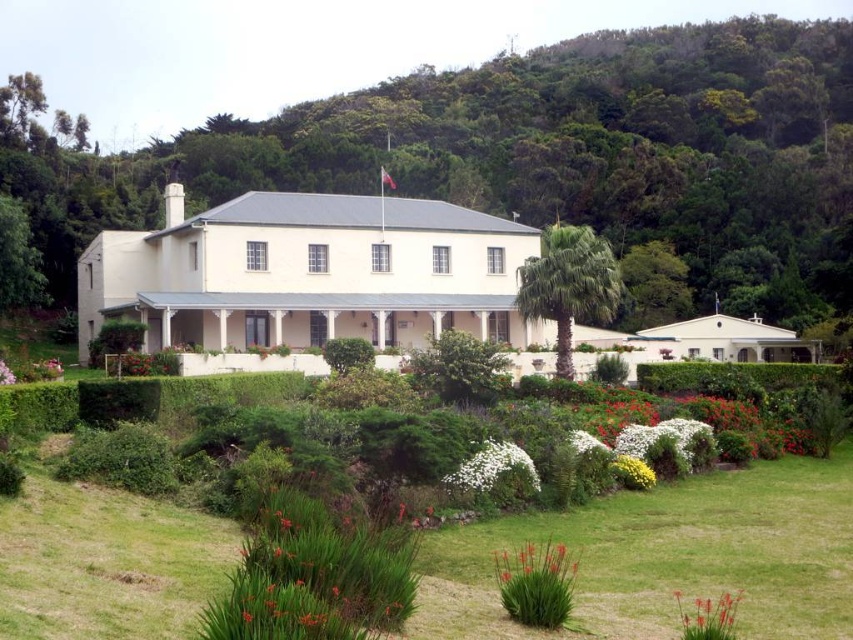
Does white fluffy flowers at lower center appear on the right side of white matte flower at center?

Yes, white fluffy flowers at lower center is to the right of white matte flower at center.

Identify the location of white fluffy flowers at lower center. (659, 435).

Can you confirm if white fluffy bush at center is wider than white fluffy flowers at lower center?

Correct, the width of white fluffy bush at center exceeds that of white fluffy flowers at lower center.

Who is positioned more to the right, white fluffy bush at center or white fluffy flowers at lower center?

white fluffy flowers at lower center

Who is more forward, (517, 458) or (614, 451)?

Point (517, 458) is more forward.

In order to click on white fluffy bush at center in this screenshot , I will do `click(491, 467)`.

Does green leafy hill at upper center appear on the right side of white fluffy bush at center?

In fact, green leafy hill at upper center is to the left of white fluffy bush at center.

Who is more forward, (843, 301) or (514, 451)?

Positioned in front is point (514, 451).

Which is in front, point (703, 232) or point (479, 451)?

Point (479, 451) is more forward.

Locate an element on the screen. This screenshot has height=640, width=853. green leafy hill at upper center is located at coordinates (534, 154).